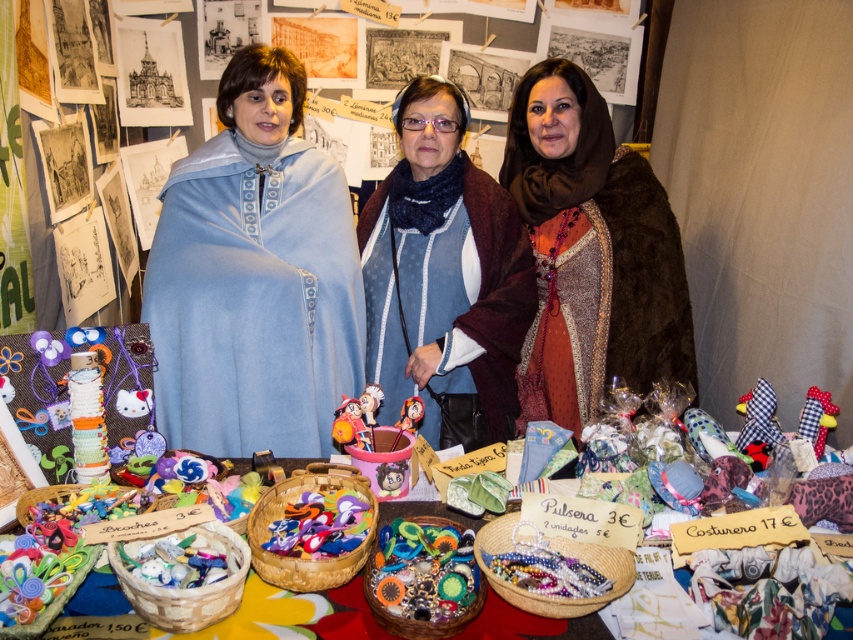
Question: Which point is farther to the camera?

Choices:
 (A) (409, 410)
 (B) (270, 145)

Answer: (B)

Question: Is blue woolen scarf at center behind plush fabric toy at center?

Choices:
 (A) yes
 (B) no

Answer: (A)

Question: Considering the real-world distances, which object is farthest from the plush fabric toy at center?

Choices:
 (A) matte blue fabric at center
 (B) multicolored fabric bracelet at center
 (C) blue woolen scarf at center
 (D) brightly colored fabric baskets at center

Answer: (A)

Question: Which point is farther to the camera?

Choices:
 (A) brown fur coat at center
 (B) brightly colored fabric baskets at center

Answer: (A)

Question: Where is matte blue fabric at center located in relation to plush fabric toy at center in the image?

Choices:
 (A) left
 (B) right

Answer: (A)

Question: Does brown fur coat at center appear over multicolored fabric bracelet at center?

Choices:
 (A) yes
 (B) no

Answer: (A)